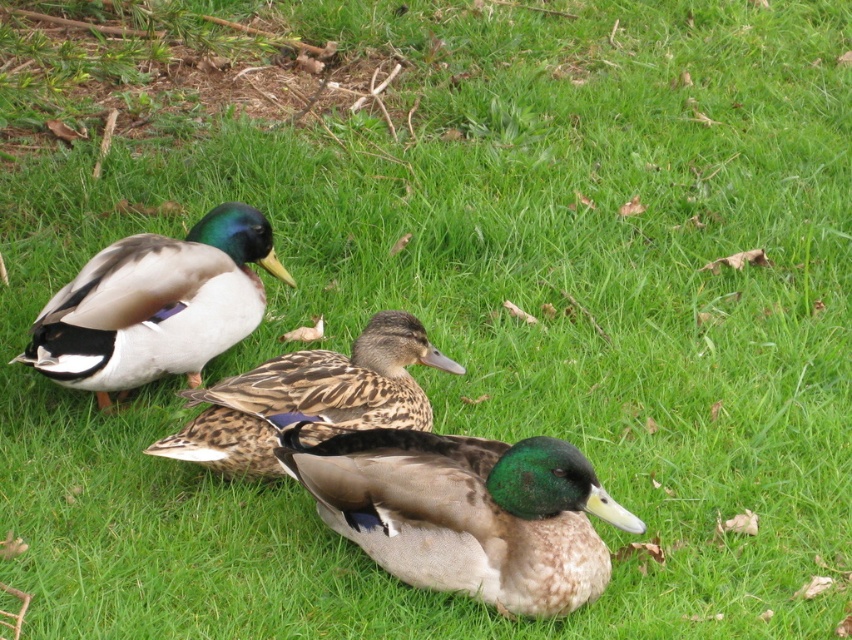
Question: Does green glossy duck at center have a larger size compared to brown speckled duck at center?

Choices:
 (A) yes
 (B) no

Answer: (A)

Question: Is green glossy duck at center smaller than shiny green drake at upper left?

Choices:
 (A) no
 (B) yes

Answer: (B)

Question: Which point is farther to the camera?

Choices:
 (A) brown speckled duck at center
 (B) green glossy duck at center

Answer: (A)

Question: Among these objects, which one is farthest from the camera?

Choices:
 (A) brown speckled duck at center
 (B) green glossy duck at center

Answer: (A)

Question: Estimate the real-world distances between objects in this image. Which object is closer to the shiny green drake at upper left?

Choices:
 (A) brown speckled duck at center
 (B) green glossy duck at center

Answer: (A)

Question: Does green glossy duck at center appear on the left side of brown speckled duck at center?

Choices:
 (A) no
 (B) yes

Answer: (A)